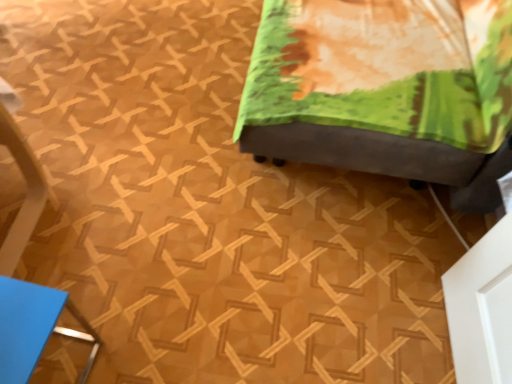
Locate an element on the screen. This screenshot has height=384, width=512. vacant region under blue matte folder at lower left, marked as the first furniture in a bottom-to-top arrangement (from a real-world perspective) is located at coordinates 57,362.